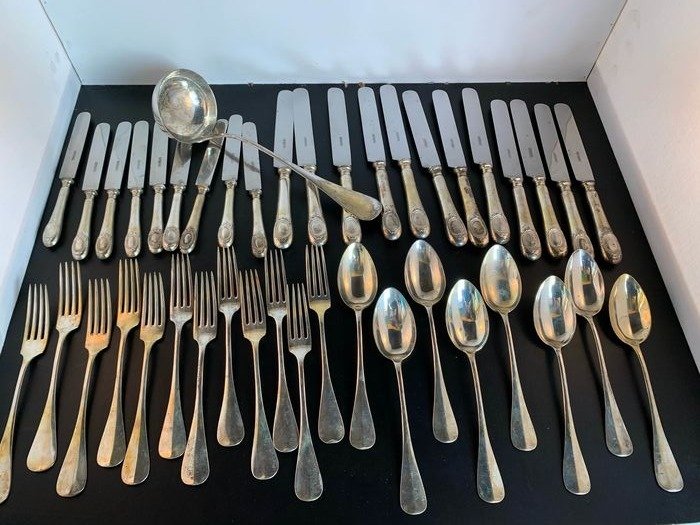
Locate an element on the screen. Image resolution: width=700 pixels, height=525 pixels. bowl of spoon is located at coordinates (358, 272), (402, 328), (430, 266), (477, 323), (553, 322), (496, 272), (588, 289), (624, 308).